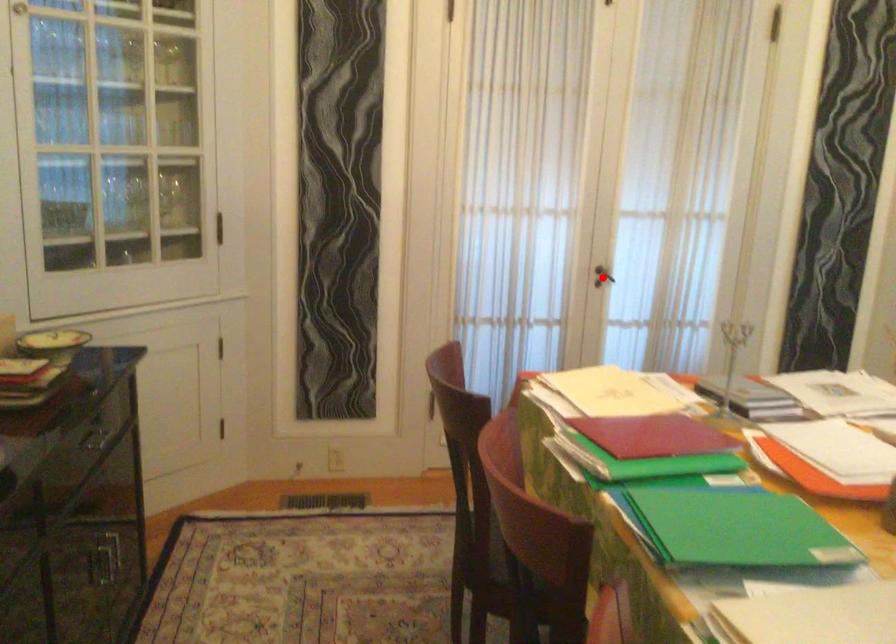
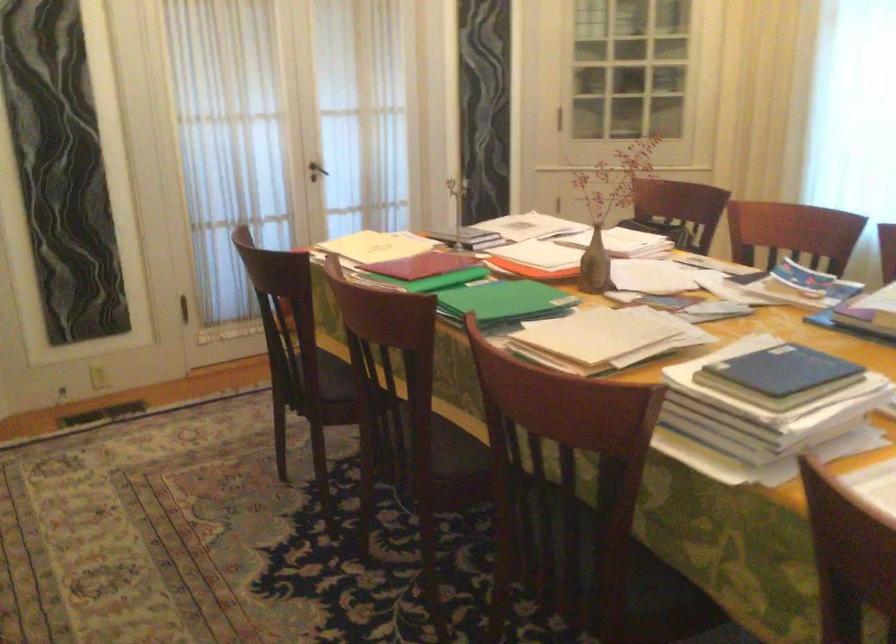
Question: I am providing you with two images of the same scene from different viewpoints. A red point is marked on the first image. Is the red point's position out of view in image 2?

Choices:
 (A) Yes
 (B) No

Answer: (B)